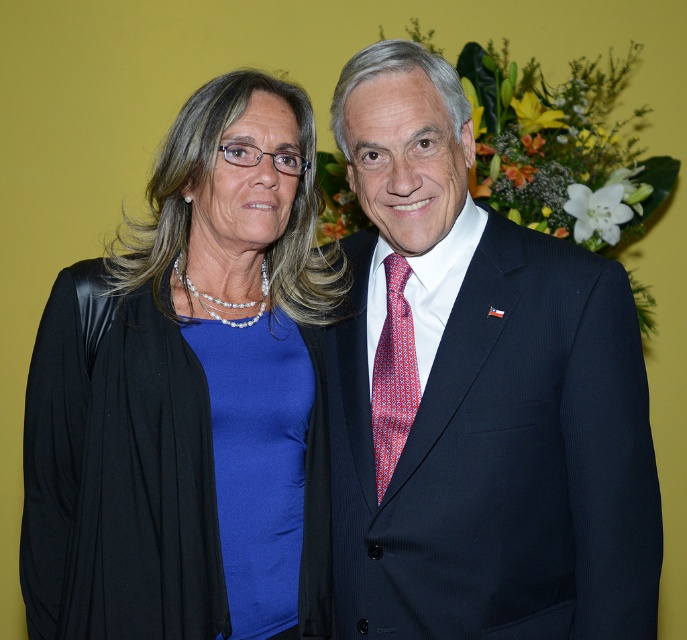
You are taking a photo of two people standing against a yellow background. You notice two points marked in the image. One is at coordinate point (534, 529) and the other at point (405, 323). If you want to focus on the point closer to the camera, which coordinate should you adjust your camera to focus on?

Point (534, 529) is closer to the camera than point (405, 323), so you should focus on point (534, 529).

You are a photographer setting up for a group photo. You need to ensure that both the dark blue suit at center and the matte black blazer at left are visible in the frame. Based on their positions, which clothing item is covering part of the other?

The dark blue suit at center is positioned over the matte black blazer at left, so it is covering part of the matte black blazer at left.

You are a photographer setting up for a group photo. You need to arrange the dark blue suit at center and the matte black blazer at left so that both individuals are visible in the frame. Given their heights, which person should stand closer to the camera to ensure their faces are equally visible?

The dark blue suit at center is shorter than the matte black blazer at left. To make their faces equally visible, the person in the dark blue suit at center should stand closer to the camera.